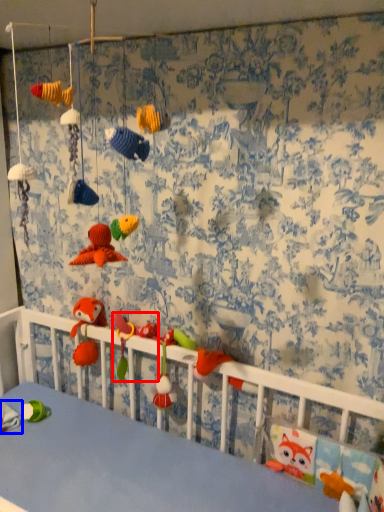
Question: Which object appears closest to the camera in this image, toy (highlighted by a red box) or toy (highlighted by a blue box)?

Choices:
 (A) toy
 (B) toy

Answer: (B)